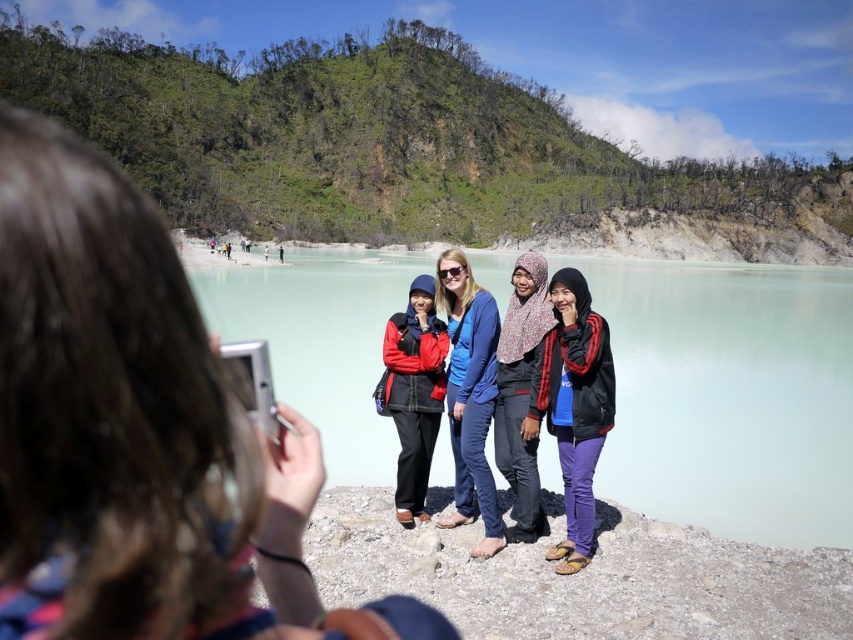
Question: Which is nearer to the light blue water at center?

Choices:
 (A) black matte jacket at center
 (B) patterned fabric hijab at center
 (C) matte black jacket at center

Answer: (A)

Question: Which of the following is the farthest from the observer?

Choices:
 (A) (576, 401)
 (B) (267, 268)
 (C) (462, 269)

Answer: (B)

Question: Is matte black jacket at center wider than black matte jacket at center?

Choices:
 (A) yes
 (B) no

Answer: (A)

Question: Which of the following is the closest to the observer?

Choices:
 (A) light blue water at center
 (B) patterned fabric hijab at center
 (C) blue cotton jacket at center
 (D) black matte jacket at center

Answer: (D)

Question: Considering the relative positions of light blue water at center and patterned fabric hijab at center in the image provided, where is light blue water at center located with respect to patterned fabric hijab at center?

Choices:
 (A) left
 (B) right

Answer: (B)

Question: Can you confirm if blue cotton jacket at center is positioned below patterned fabric hijab at center?

Choices:
 (A) yes
 (B) no

Answer: (A)